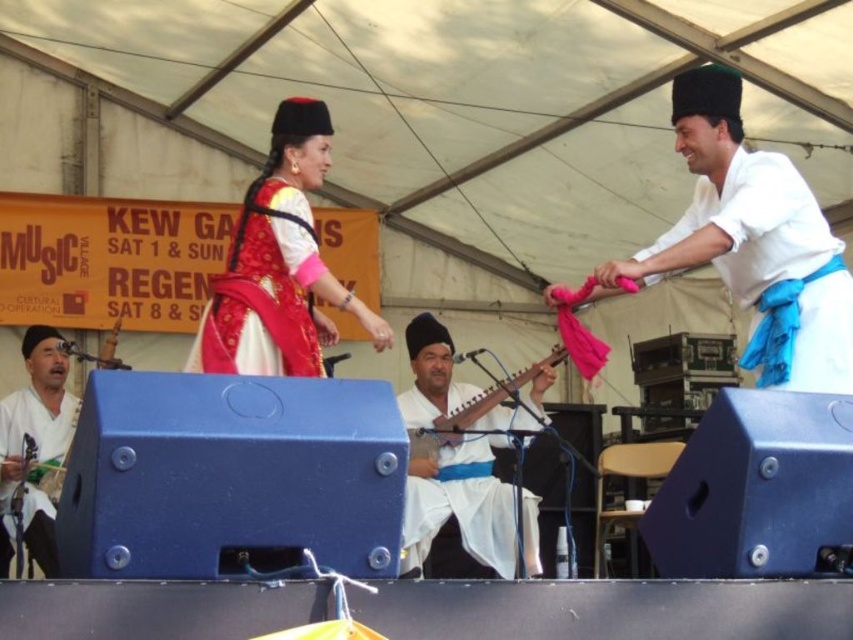
Question: Does white cotton shirt at upper right appear on the right side of matte red fabric dress at center?

Choices:
 (A) yes
 (B) no

Answer: (A)

Question: Is white cotton shirt at upper right bigger than white satin/silk guitar at center?

Choices:
 (A) yes
 (B) no

Answer: (B)

Question: Which point is closer to the camera?

Choices:
 (A) (212, 340)
 (B) (502, 538)
 (C) (756, 310)

Answer: (C)

Question: Does white cotton shirt at upper right have a smaller size compared to matte white shirt at lower left?

Choices:
 (A) yes
 (B) no

Answer: (A)

Question: Which object appears farthest from the camera in this image?

Choices:
 (A) matte red fabric dress at center
 (B) matte white shirt at lower left
 (C) white cotton shirt at upper right
 (D) white satin/silk guitar at center

Answer: (D)

Question: Based on their relative distances, which object is nearer to the white satin/silk guitar at center?

Choices:
 (A) matte white shirt at lower left
 (B) matte red fabric dress at center
 (C) white cotton shirt at upper right

Answer: (B)